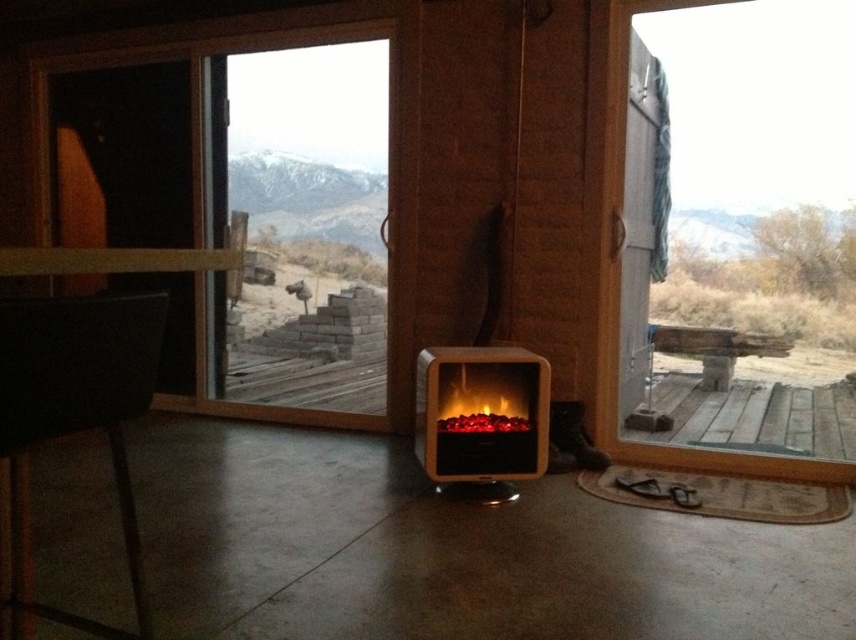
Question: Observing the image, what is the correct spatial positioning of transparent glass door at right in reference to black leather chair at left?

Choices:
 (A) right
 (B) left

Answer: (A)

Question: Which point appears closest to the camera in this image?

Choices:
 (A) (126, 538)
 (B) (375, 160)

Answer: (A)

Question: Is black leather chair at left above weathered wood deck at lower right?

Choices:
 (A) yes
 (B) no

Answer: (B)

Question: Which object is farther from the camera taking this photo?

Choices:
 (A) wooden deck at center
 (B) wooden electric fireplace at center

Answer: (B)

Question: Where is black leather chair at left located in relation to wooden electric fireplace at center in the image?

Choices:
 (A) left
 (B) right

Answer: (A)

Question: Which point is closer to the camera taking this photo?

Choices:
 (A) (31, 317)
 (B) (470, 403)

Answer: (A)